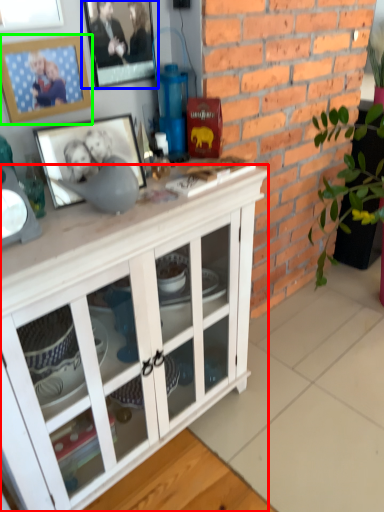
Question: Based on their relative distances, which object is farther from cabinetry (highlighted by a red box)? Choose from picture frame (highlighted by a blue box) and picture frame (highlighted by a green box).

Choices:
 (A) picture frame
 (B) picture frame

Answer: (A)